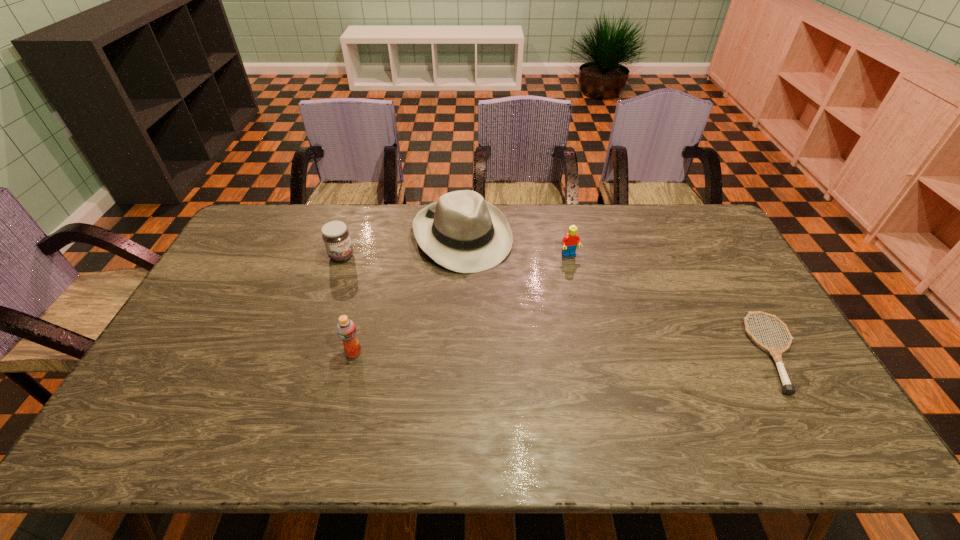
In order to click on vacant spot on the desktop that is between the orange juice and the rightmost object and is positioned on the face of the second object from right to left in this screenshot , I will do `click(623, 353)`.

Find the location of a particular element. The height and width of the screenshot is (540, 960). free spot on the desktop that is between the orange juice and the shortest object and is positioned on the front-facing side of the third object from right to left is located at coordinates (544, 353).

At what (x,y) coordinates should I click in order to perform the action: click on vacant space on the desktop that is between the orange juice and the shortest object and is positioned on the front label of the jam. Please return your answer as a coordinate pair (x, y). The height and width of the screenshot is (540, 960). Looking at the image, I should click on (514, 353).